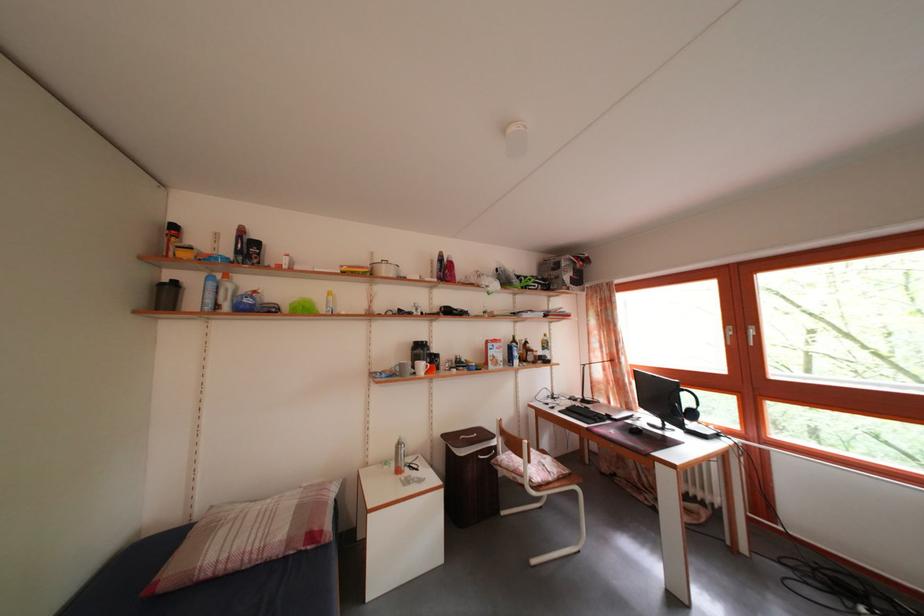
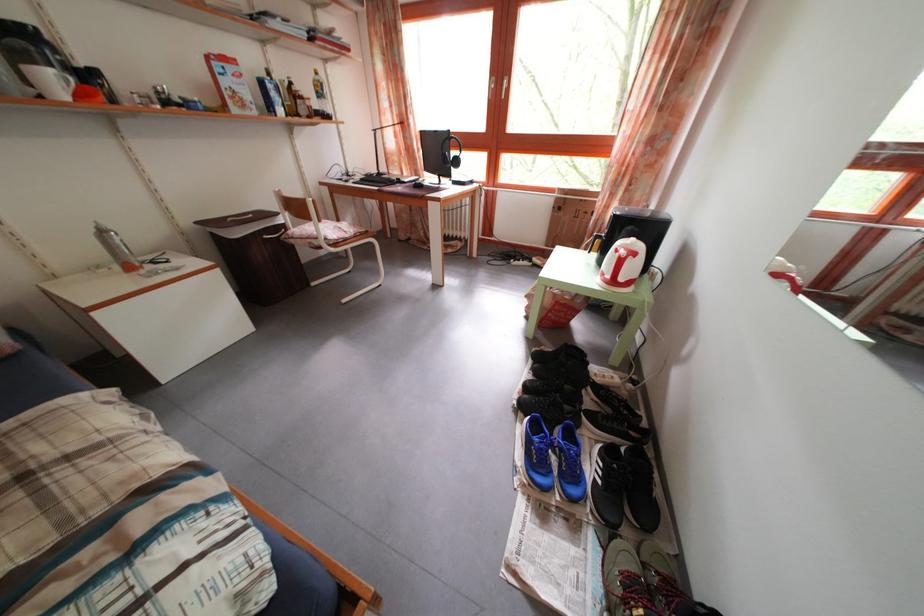
Where in the second image is the point corresponding to point 619,411 from the first image?

(412, 182)